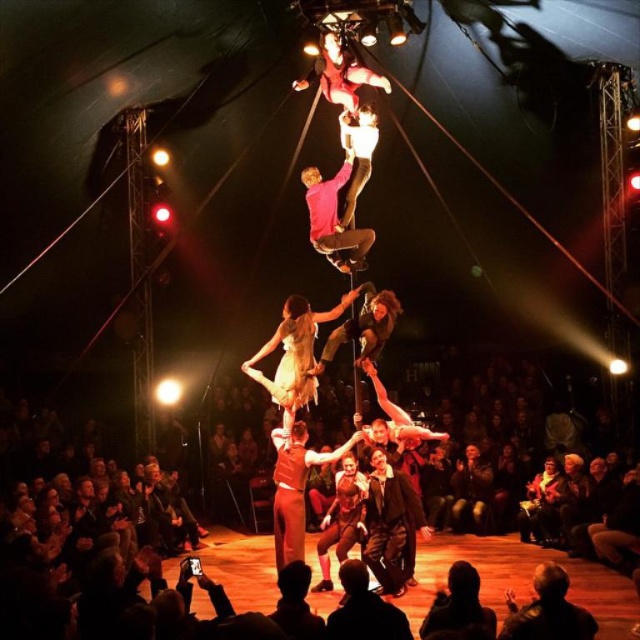
Question: Is leather jacket at lower right further to camera compared to dark hair at lower center?

Choices:
 (A) no
 (B) yes

Answer: (B)

Question: Which object is the closest to the leather jacket at lower right?

Choices:
 (A) dark hair at lower center
 (B) dark clothing audience at lower center

Answer: (A)

Question: Does dark clothing audience at lower center come in front of leather jacket at lower right?

Choices:
 (A) yes
 (B) no

Answer: (B)

Question: Does dark clothing audience at lower center have a smaller size compared to dark hair at lower center?

Choices:
 (A) yes
 (B) no

Answer: (B)

Question: Which point is closer to the camera?

Choices:
 (A) (461, 570)
 (B) (70, 568)
 (C) (557, 586)

Answer: (C)

Question: Which point is closer to the camera taking this photo?

Choices:
 (A) (564, 582)
 (B) (150, 589)
 (C) (429, 612)

Answer: (A)